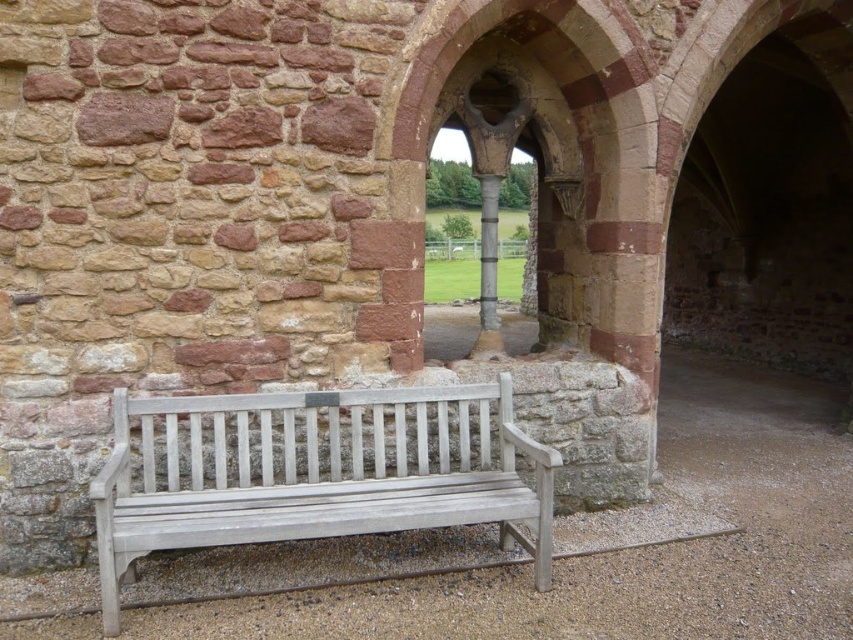
Question: Can you confirm if white wood bench at center is thinner than smooth gray stone pillar at center?

Choices:
 (A) no
 (B) yes

Answer: (A)

Question: Among these objects, which one is farthest from the camera?

Choices:
 (A) white wood bench at center
 (B) smooth gray stone pillar at center

Answer: (B)

Question: Can you confirm if white wood bench at center is bigger than smooth gray stone pillar at center?

Choices:
 (A) no
 (B) yes

Answer: (A)

Question: Can you confirm if white wood bench at center is positioned to the left of smooth gray stone pillar at center?

Choices:
 (A) yes
 (B) no

Answer: (A)